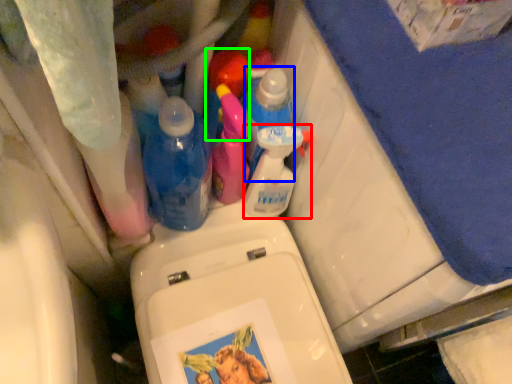
Question: Which object is the closest to the cleaning product (highlighted by a red box)? Choose among these: cleaning product (highlighted by a blue box) or cleaning product (highlighted by a green box).

Choices:
 (A) cleaning product
 (B) cleaning product

Answer: (A)